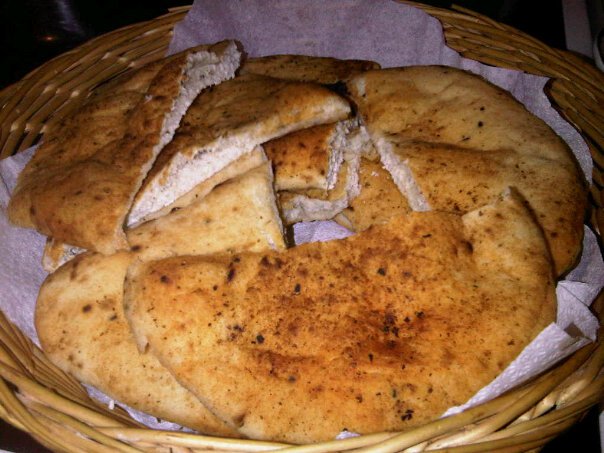
The height and width of the screenshot is (453, 604). I want to click on basket, so click(50, 107).